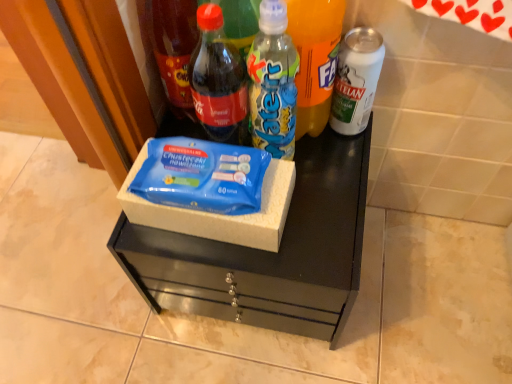
Locate an element on the screen. vacant point to the right of blue cardboard box at center is located at coordinates (324, 211).